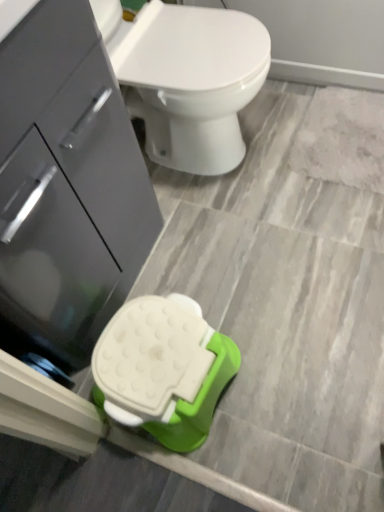
Where is `matte gray cabinet at center`? matte gray cabinet at center is located at coordinates (67, 183).

Image resolution: width=384 pixels, height=512 pixels. What do you see at coordinates (67, 183) in the screenshot?
I see `matte gray cabinet at center` at bounding box center [67, 183].

Find the location of a particular element. The height and width of the screenshot is (512, 384). matte gray cabinet at center is located at coordinates (67, 183).